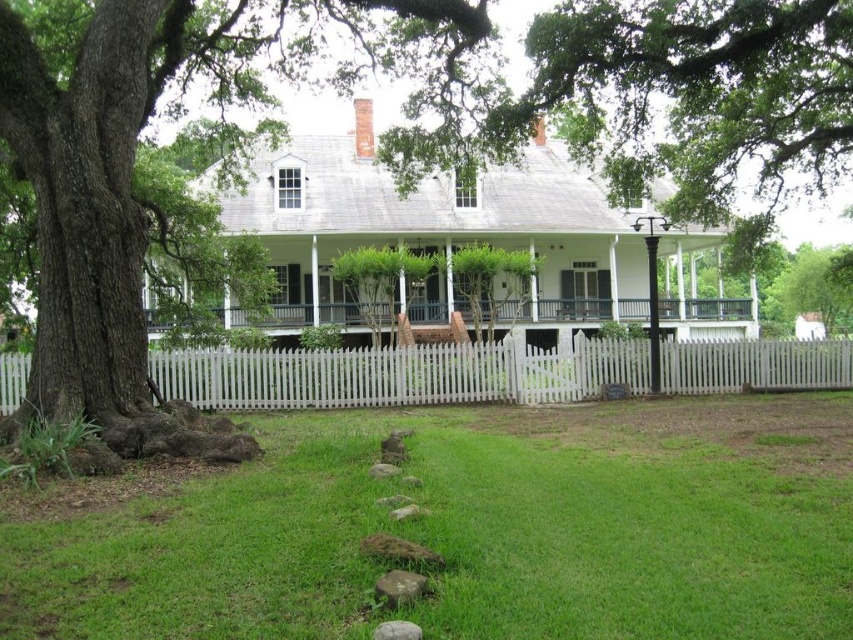
Does smooth bark tree at left have a greater width compared to white picket fence at center?

Incorrect, smooth bark tree at left's width does not surpass white picket fence at center's.

Who is shorter, smooth bark tree at left or white picket fence at center?

white picket fence at center is shorter.

This screenshot has width=853, height=640. What do you see at coordinates (132, 188) in the screenshot? I see `smooth bark tree at left` at bounding box center [132, 188].

At what (x,y) coordinates should I click in order to perform the action: click on smooth bark tree at left. Please return your answer as a coordinate pair (x, y). Looking at the image, I should click on (132, 188).

Who is lower down, green grass at lower center or white picket fence at center?

Positioned lower is green grass at lower center.

How distant is green grass at lower center from white picket fence at center?

green grass at lower center and white picket fence at center are 26.35 feet apart.

Identify the location of green grass at lower center. (463, 529).

Between green grass at lower center and white wooden porch at center, which one appears on the right side from the viewer's perspective?

white wooden porch at center is more to the right.

Which of these two, green grass at lower center or white wooden porch at center, stands taller?

white wooden porch at center is taller.

Does point (457, 611) come behind point (708, 320)?

No, it is in front of (708, 320).

Where is `green grass at lower center`? green grass at lower center is located at coordinates (463, 529).